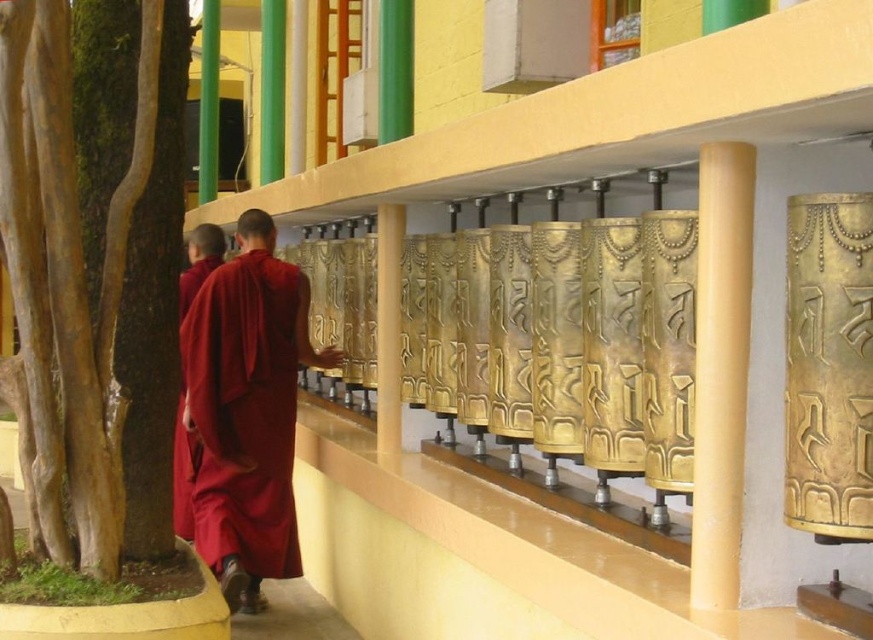
You are a visitor at the temple and want to take a photo of the maroon cloth monk at center without any obstructions. Is the smooth brown bark at left blocking your view of the monk?

The smooth brown bark at left is in front of the maroon cloth monk at center, so it would block your view of the monk. Move to a position where the bark is not between you and the monk to take an unobstructed photo.

You are a visitor to the temple and want to take a photo of both maroon cloth monk at center and maroon cloth monk at left. Which monk should you position closer to the camera to ensure both are in focus?

You should position the maroon cloth monk at left closer to the camera because the maroon cloth monk at center is in front of the maroon cloth monk at left, so adjusting their positions will help both be in focus.